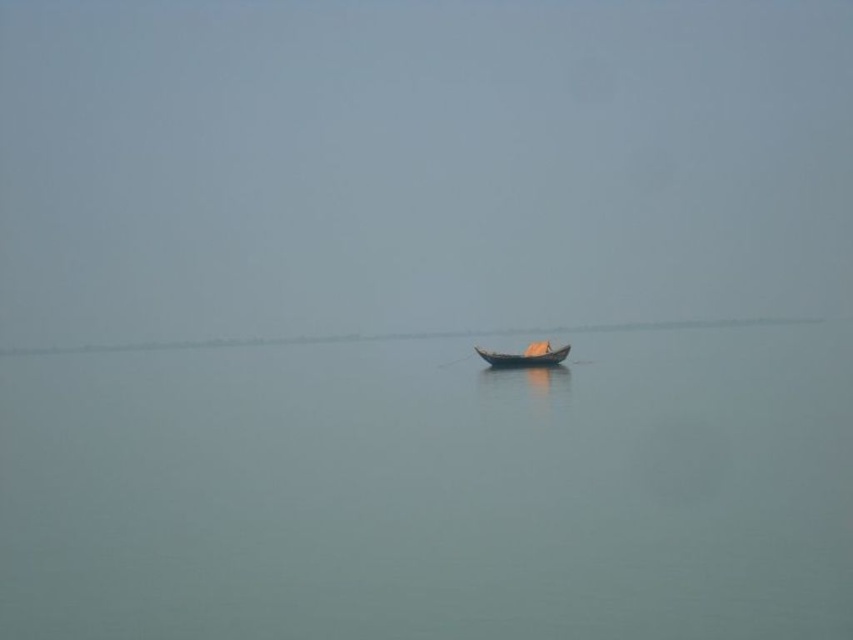
Based on the scene described, if you were standing on the wooden boat at center, would the smooth water at center be visible to you?

Yes, the smooth water at center is below the wooden boat at center, so if you were standing on the wooden boat at center, you would be able to see the smooth water at center beneath you.